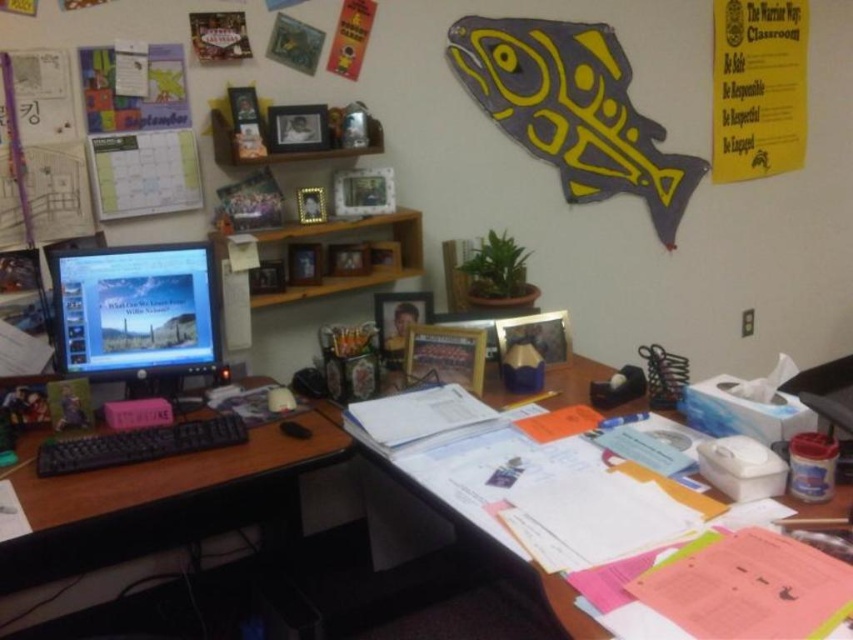
Is point (80, 484) closer to camera compared to point (70, 356)?

Yes, it is.

Who is positioned more to the right, black plastic keyboard at left or matte black monitor at left?

matte black monitor at left

The width and height of the screenshot is (853, 640). What do you see at coordinates (149, 515) in the screenshot?
I see `black plastic keyboard at left` at bounding box center [149, 515].

Find the location of `black plastic keyboard at left`. black plastic keyboard at left is located at coordinates (149, 515).

Does black plastic keyboard at left appear over white paper at center?

No, black plastic keyboard at left is not above white paper at center.

Which is in front, point (279, 449) or point (579, 416)?

Positioned in front is point (279, 449).

Where is `black plastic keyboard at left`? The height and width of the screenshot is (640, 853). black plastic keyboard at left is located at coordinates 149,515.

Does matte black monitor at left have a larger size compared to white paper at center?

No, matte black monitor at left is not bigger than white paper at center.

Between matte black monitor at left and white paper at center, which one appears on the left side from the viewer's perspective?

matte black monitor at left is more to the left.

Who is more distant from viewer, (84, 288) or (378, 458)?

The point (84, 288) is behind.

Locate an element on the screen. matte black monitor at left is located at coordinates (x=136, y=310).